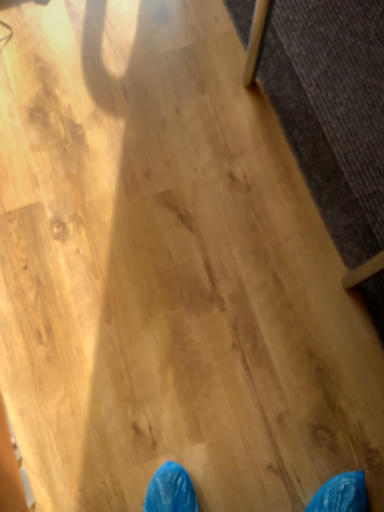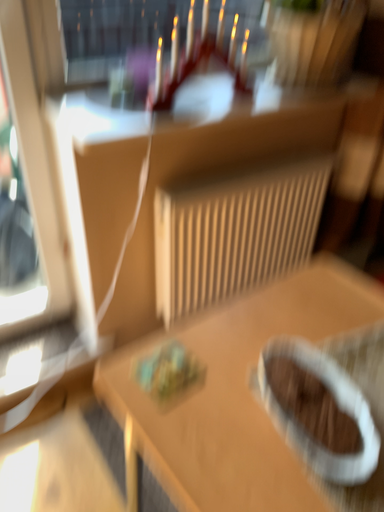
Question: How did the camera likely rotate when shooting the video?

Choices:
 (A) rotated downward
 (B) rotated upward

Answer: (B)